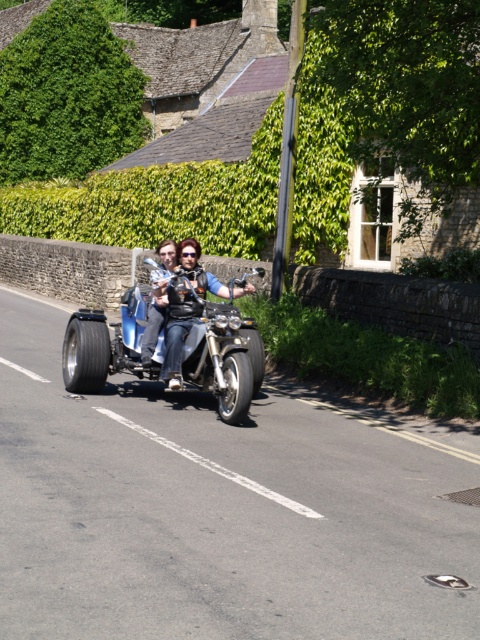
Question: Which point is farther to the camera?

Choices:
 (A) (193, 304)
 (B) (164, 342)
 (C) (106, 74)

Answer: (C)

Question: Is shiny chrome motorcycle at center further to camera compared to leather jacket at center?

Choices:
 (A) no
 (B) yes

Answer: (B)

Question: Can you confirm if green leafy hedge at upper left is positioned below leather jacket at center?

Choices:
 (A) yes
 (B) no

Answer: (B)

Question: Is green leafy hedge at upper left closer to the viewer compared to leather jacket at center?

Choices:
 (A) yes
 (B) no

Answer: (B)

Question: Which point is farther to the camera?

Choices:
 (A) (75, 355)
 (B) (87, 134)
 (C) (187, 241)

Answer: (B)

Question: Which object appears closest to the camera in this image?

Choices:
 (A) shiny chrome motorcycle at center
 (B) leather jacket at center

Answer: (B)